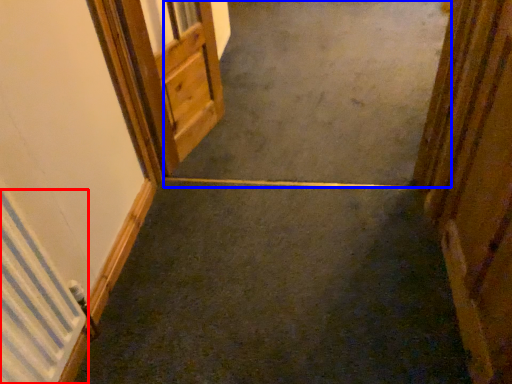
Question: Which object is further to the camera taking this photo, radiator (highlighted by a red box) or concrete (highlighted by a blue box)?

Choices:
 (A) radiator
 (B) concrete

Answer: (B)